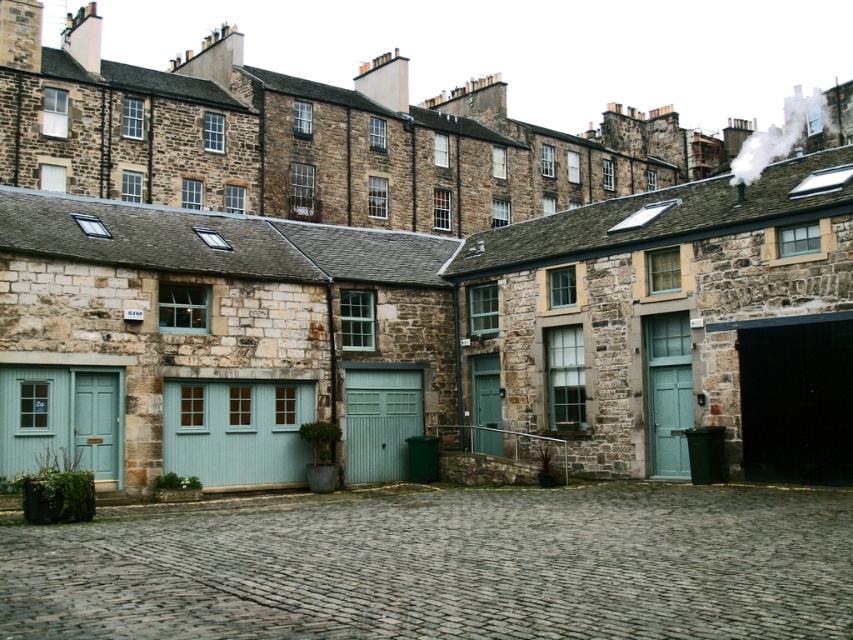
Can you confirm if light blue wooden garage door at center is positioned above green corrugated metal garage door at center?

Incorrect, light blue wooden garage door at center is not positioned above green corrugated metal garage door at center.

The image size is (853, 640). Describe the element at coordinates (236, 429) in the screenshot. I see `light blue wooden garage door at center` at that location.

This screenshot has width=853, height=640. I want to click on light blue wooden garage door at center, so click(236, 429).

This screenshot has width=853, height=640. I want to click on cobblestone at center, so tap(444, 564).

Does cobblestone at center have a greater height compared to teal painted wood garage door at lower left?

No.

This screenshot has width=853, height=640. Describe the element at coordinates (444, 564) in the screenshot. I see `cobblestone at center` at that location.

The height and width of the screenshot is (640, 853). Identify the location of cobblestone at center. (444, 564).

Locate an element on the screen. The width and height of the screenshot is (853, 640). cobblestone at center is located at coordinates (444, 564).

Does cobblestone at center have a lesser height compared to light blue wooden garage door at center?

Correct, cobblestone at center is not as tall as light blue wooden garage door at center.

Describe the element at coordinates (444, 564) in the screenshot. I see `cobblestone at center` at that location.

The image size is (853, 640). What are the coordinates of `cobblestone at center` in the screenshot? It's located at (444, 564).